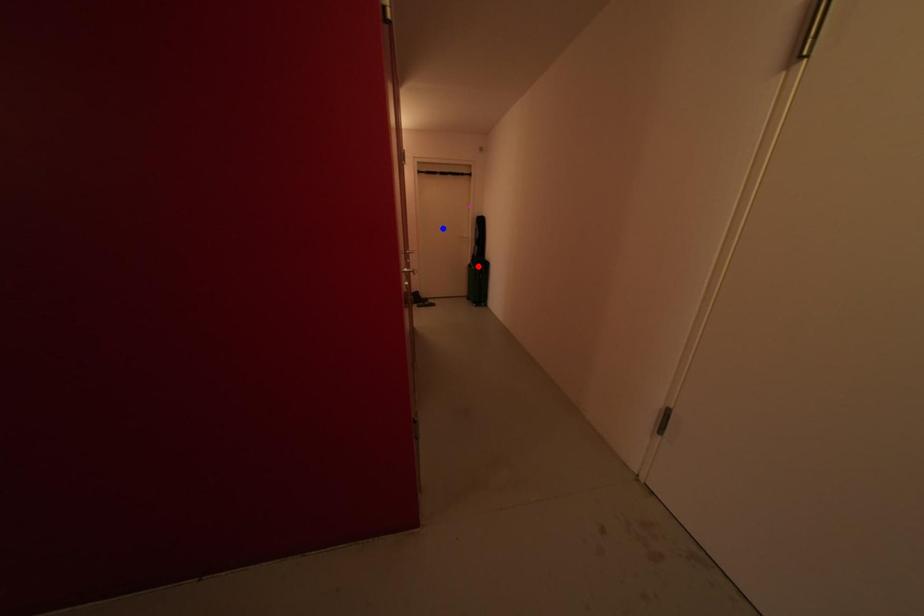
Question: Two points are marked on the image. Which point is closer to the camera?

Choices:
 (A) Blue point is closer.
 (B) Red point is closer.

Answer: (B)